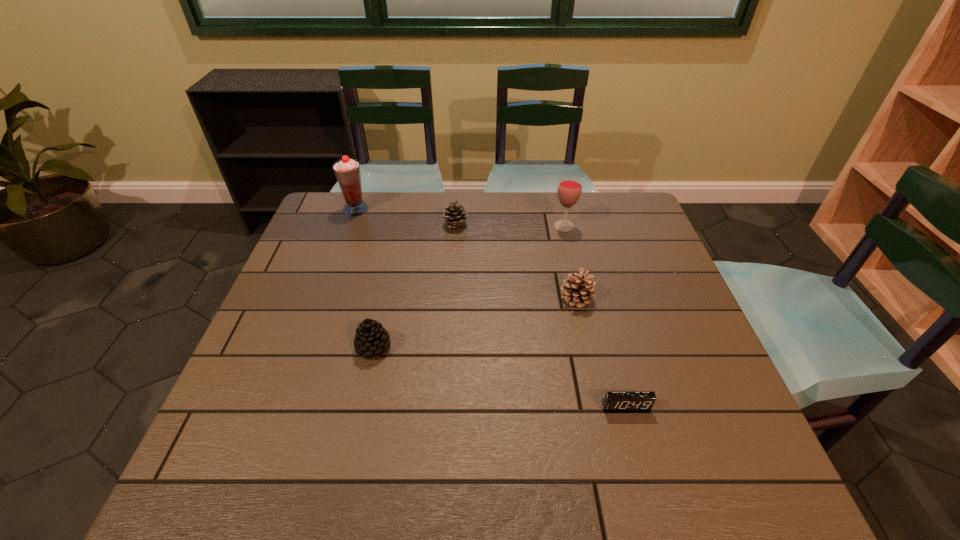
Where is `the farthest object`? The width and height of the screenshot is (960, 540). the farthest object is located at coordinates (347, 171).

Image resolution: width=960 pixels, height=540 pixels. I want to click on smoothie, so click(347, 171).

Identify the location of the fifth shortest object. (569, 189).

You are a GUI agent. You are given a task and a screenshot of the screen. Output one action in this format:
    pyautogui.click(x=<x>, y=<y>)
    Task: Click on the second farthest pinecone
    This screenshot has width=960, height=540.
    Given the screenshot: What is the action you would take?
    pyautogui.click(x=578, y=289)

Locate an element on the screen. the rightmost pinecone is located at coordinates (578, 289).

Locate an element on the screen. This screenshot has height=540, width=960. the fifth object from right to left is located at coordinates (371, 338).

You are a GUI agent. You are given a task and a screenshot of the screen. Output one action in this format:
    pyautogui.click(x=<x>, y=<y>)
    Task: Click on the fifth farthest object
    
    Given the screenshot: What is the action you would take?
    [371, 338]

The width and height of the screenshot is (960, 540). I want to click on the third object from left to right, so click(454, 216).

Where is `the farthest pinecone`? the farthest pinecone is located at coordinates (454, 216).

Find the location of `alarm clock`. alarm clock is located at coordinates 614,400.